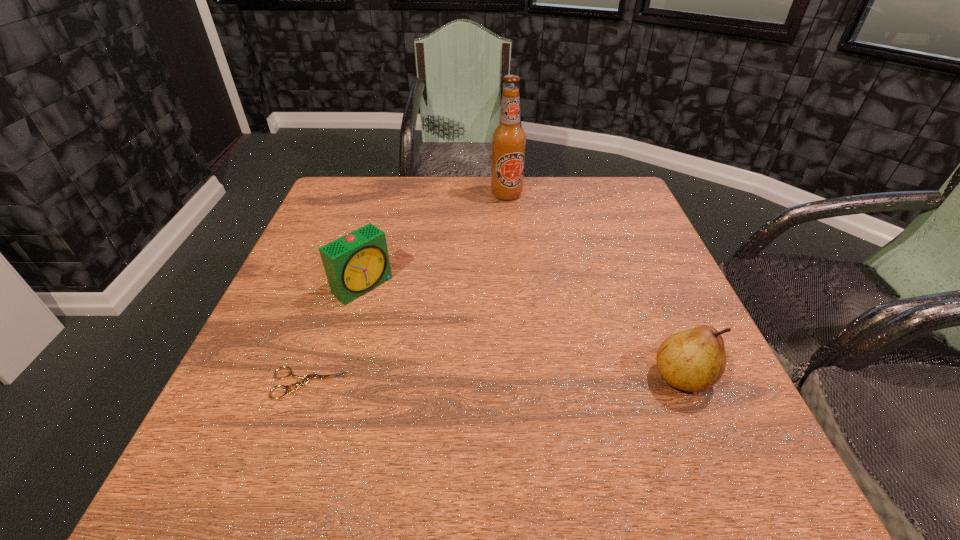
Where is `vacant position in the image that satisfies the following two spatial constraints: 1. on the back side of the farthest object; 2. on the left side of the shears`? The image size is (960, 540). vacant position in the image that satisfies the following two spatial constraints: 1. on the back side of the farthest object; 2. on the left side of the shears is located at coordinates (374, 194).